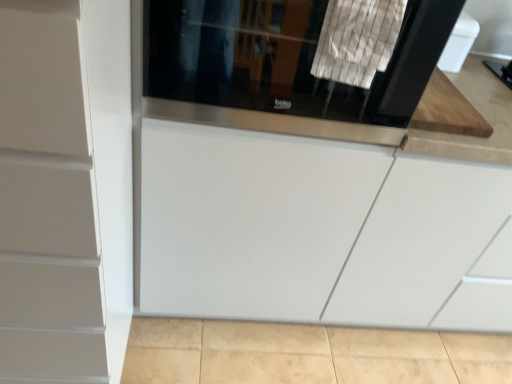
What do you see at coordinates (65, 190) in the screenshot? Image resolution: width=512 pixels, height=384 pixels. I see `white matte cabinet at left` at bounding box center [65, 190].

Describe the element at coordinates (283, 68) in the screenshot. I see `black glass screen door at upper center` at that location.

Locate an element on the screen. white matte cabinet at left is located at coordinates (65, 190).

From a real-world perspective, which object rests below the other?

white matte cabinet at left, from a real-world perspective.

Choose the correct answer: Is white matte cabinet at left inside white striped fabric at upper center or outside it?

white matte cabinet at left is not inside white striped fabric at upper center, it's outside.

Consider the image. Is white matte cabinet at left to the left or to the right of white striped fabric at upper center in the image?

From the image, it's evident that white matte cabinet at left is to the left of white striped fabric at upper center.

From the image's perspective, between white matte cabinet at left and white striped fabric at upper center, which one is located above?

white striped fabric at upper center, from the image's perspective.

In the image, is black glass screen door at upper center on the left side or the right side of white striped fabric at upper center?

Clearly, black glass screen door at upper center is on the left of white striped fabric at upper center in the image.

From the image's perspective, would you say black glass screen door at upper center is shown under white striped fabric at upper center?

No.

Is black glass screen door at upper center positioned with its back to white striped fabric at upper center?

No.

Does point (328, 137) lie in front of point (353, 27)?

That is False.

Is white striped fabric at upper center in contact with black glass screen door at upper center?

Result: No, white striped fabric at upper center is not with black glass screen door at upper center.

From the image's perspective, relative to black glass screen door at upper center, is white striped fabric at upper center above or below?

white striped fabric at upper center is situated lower than black glass screen door at upper center in the image.

Could you measure the distance between white striped fabric at upper center and black glass screen door at upper center?

They are 5.67 inches apart.

Considering the relative positions of white striped fabric at upper center and black glass screen door at upper center in the image provided, is white striped fabric at upper center in front of black glass screen door at upper center?

Yes, white striped fabric at upper center is in front of black glass screen door at upper center.

Is point (360, 38) farther from camera compared to point (25, 38)?

Yes, point (360, 38) is farther from viewer.

From the image's perspective, which object appears higher, white striped fabric at upper center or white matte cabinet at left?

white striped fabric at upper center.

Considering the relative sizes of white striped fabric at upper center and white matte cabinet at left in the image provided, is white striped fabric at upper center wider than white matte cabinet at left?

In fact, white striped fabric at upper center might be narrower than white matte cabinet at left.

Which object is positioned more to the left, black glass screen door at upper center or white matte cabinet at left?

Positioned to the left is white matte cabinet at left.

Is point (388, 86) in front of point (89, 43)?

No, (388, 86) is further to viewer.

Considering the relative sizes of black glass screen door at upper center and white matte cabinet at left in the image provided, is black glass screen door at upper center wider than white matte cabinet at left?

Indeed, black glass screen door at upper center has a greater width compared to white matte cabinet at left.

From the picture: Which object is further away from the camera taking this photo, black glass screen door at upper center or white matte cabinet at left?

black glass screen door at upper center is behind.

In the scene shown: Could black glass screen door at upper center be considered to be inside white matte cabinet at left?

No, white matte cabinet at left does not contain black glass screen door at upper center.

Is white matte cabinet at left at the right side of black glass screen door at upper center?

In fact, white matte cabinet at left is to the left of black glass screen door at upper center.

Which point is more distant from viewer, (11, 239) or (271, 73)?

The point (271, 73) is farther from the camera.

From a real-world perspective, is white matte cabinet at left under black glass screen door at upper center?

Yes, from a real-world perspective, white matte cabinet at left is below black glass screen door at upper center.

This screenshot has height=384, width=512. In the image, there is a white matte cabinet at left. In order to click on laundry above it (from the image's perspective) in this screenshot , I will do `click(357, 40)`.

Where is `screen door below the white striped fabric at upper center (from a real-world perspective)`? screen door below the white striped fabric at upper center (from a real-world perspective) is located at coordinates (283, 68).

Looking at the image, which one is located further to white striped fabric at upper center, white matte cabinet at left or black glass screen door at upper center?

white matte cabinet at left is further to white striped fabric at upper center.

From the image, which object appears to be farther from white matte cabinet at left, white striped fabric at upper center or black glass screen door at upper center?

white striped fabric at upper center is further to white matte cabinet at left.

From the image, which object appears to be farther from white matte cabinet at left, black glass screen door at upper center or white striped fabric at upper center?

Among the two, white striped fabric at upper center is located further to white matte cabinet at left.

From the image, which object appears to be farther from black glass screen door at upper center, white striped fabric at upper center or white matte cabinet at left?

white matte cabinet at left lies further to black glass screen door at upper center than the other object.

Looking at the image, which one is located closer to black glass screen door at upper center, white matte cabinet at left or white striped fabric at upper center?

The object closer to black glass screen door at upper center is white striped fabric at upper center.

Based on their spatial positions, is black glass screen door at upper center or white matte cabinet at left closer to white striped fabric at upper center?

Among the two, black glass screen door at upper center is located nearer to white striped fabric at upper center.

The image size is (512, 384). I want to click on screen door between white matte cabinet at left and white striped fabric at upper center in the horizontal direction, so click(x=283, y=68).